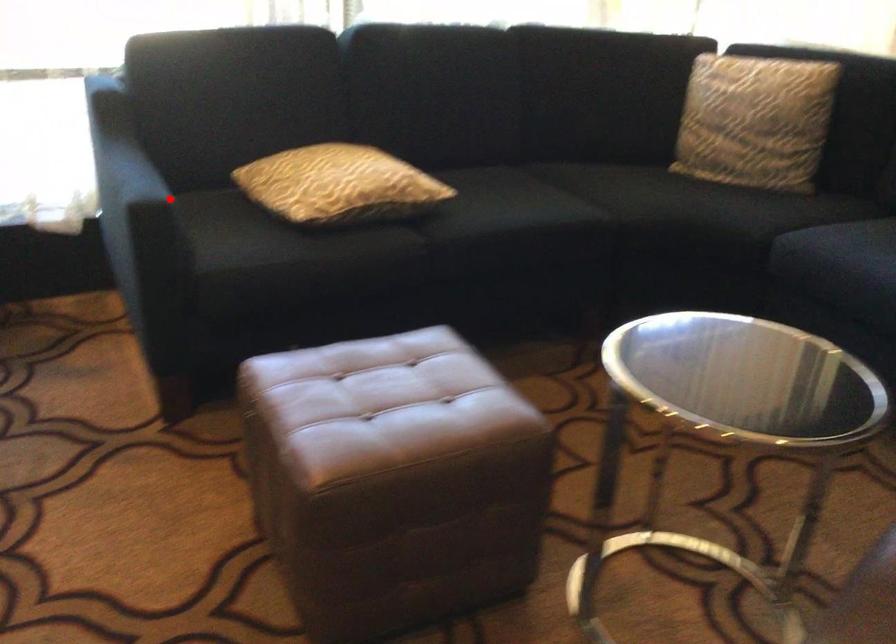
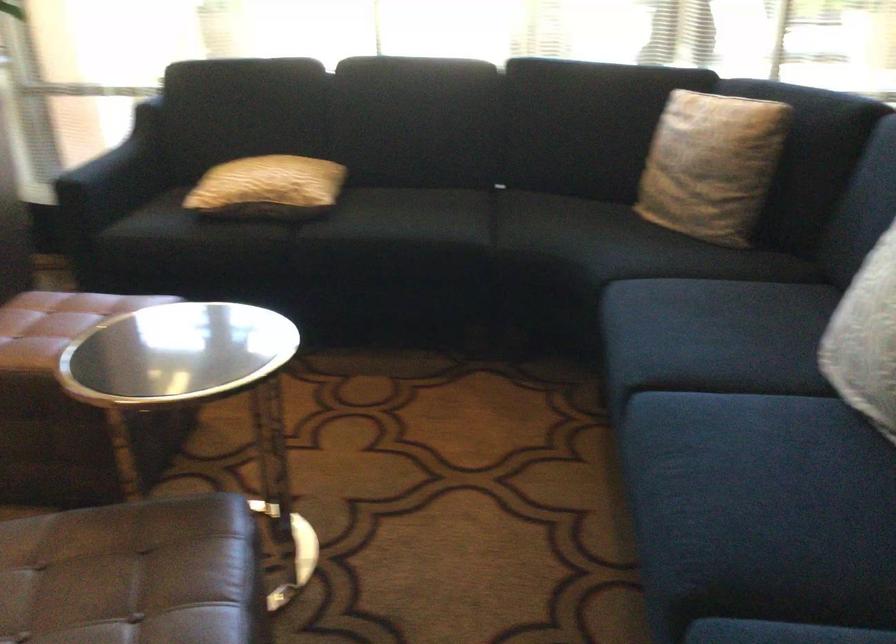
Locate, in the second image, the point that corresponds to the highlighted location in the first image.

(115, 176)